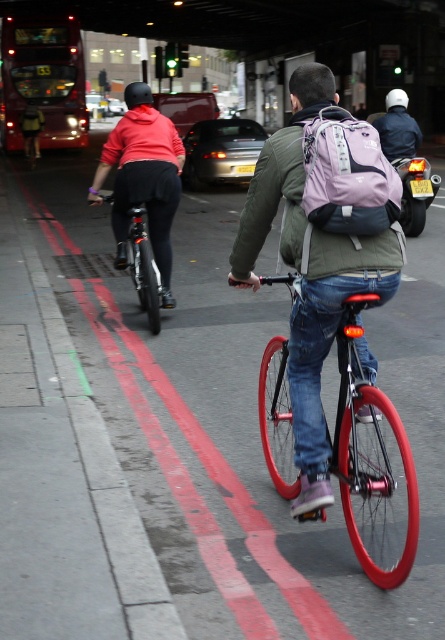
Question: Does red rubber bike lane at center have a larger size compared to shiny red bicycle at center?

Choices:
 (A) yes
 (B) no

Answer: (A)

Question: Is red rubber bike lane at center wider than matte pink backpack at center?

Choices:
 (A) no
 (B) yes

Answer: (B)

Question: Which of the following is the farthest from the observer?

Choices:
 (A) shiny red bicycle at center
 (B) matte black helmet at upper left
 (C) red rubber bike lane at center
 (D) green matte jacket at center

Answer: (B)

Question: Is green matte jacket at center thinner than shiny black bicycle at left?

Choices:
 (A) no
 (B) yes

Answer: (A)

Question: Among these objects, which one is farthest from the camera?

Choices:
 (A) matte gray jacket at center
 (B) matte black helmet at upper left
 (C) green matte jacket at center

Answer: (A)

Question: Which object is the farthest from the red rubber bike lane at center?

Choices:
 (A) matte gray jacket at center
 (B) matte pink backpack at center

Answer: (A)